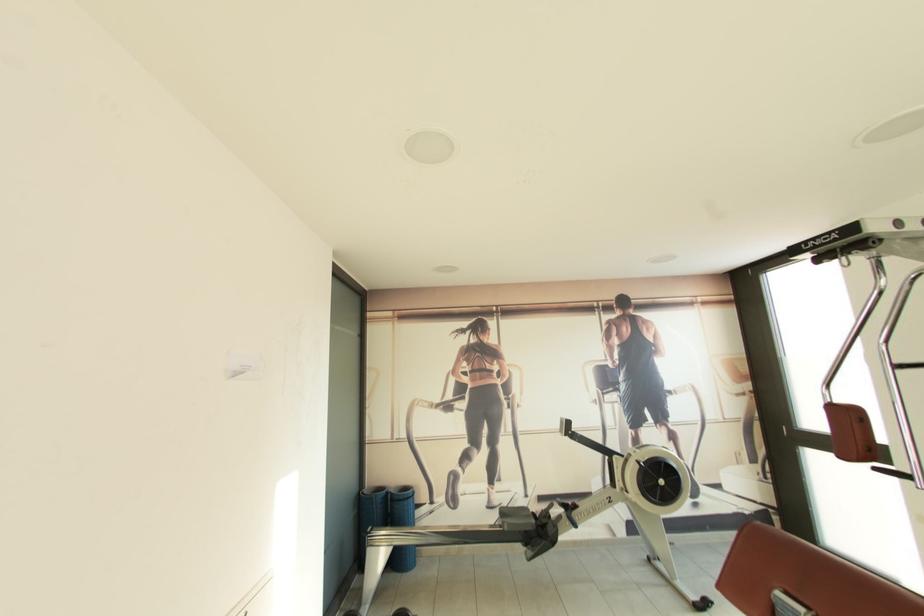
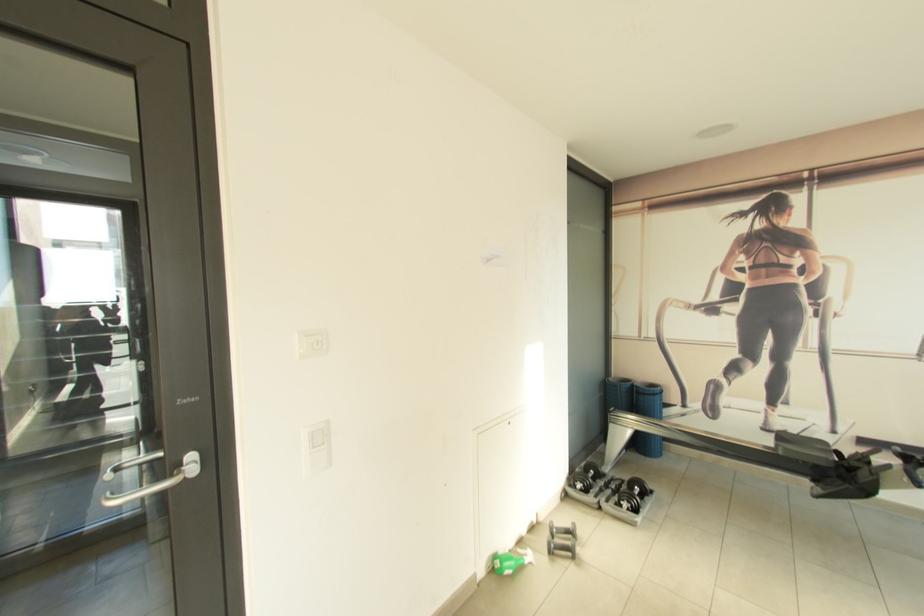
Question: The camera is either moving clockwise (left) or counter-clockwise (right) around the object. The first image is from the beginning of the video and the second image is from the end. Is the camera moving left or right when shooting the video?

Choices:
 (A) Left
 (B) Right

Answer: (B)